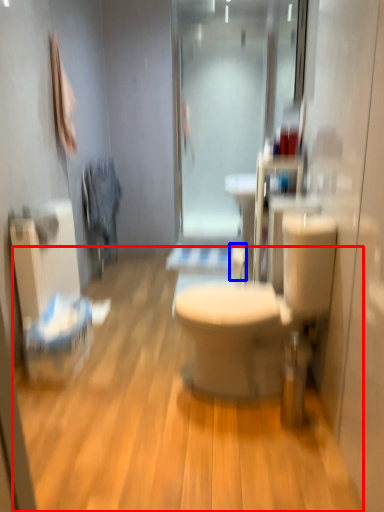
Question: Which point is further to the camera, plain (highlighted by a red box) or toilet paper (highlighted by a blue box)?

Choices:
 (A) plain
 (B) toilet paper

Answer: (B)